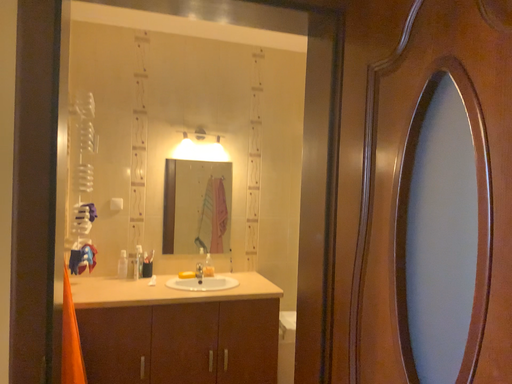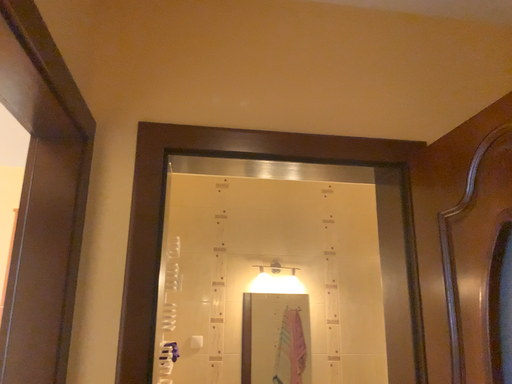
Question: Which way did the camera rotate in the video?

Choices:
 (A) rotated upward
 (B) rotated downward

Answer: (A)